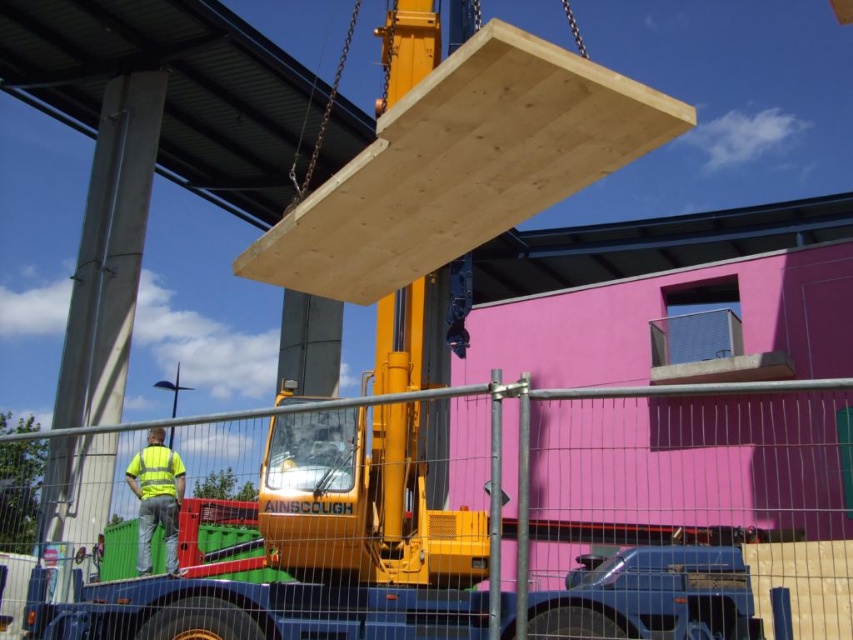
Between yellow reflective vest at lower left and yellow reflective safety vest at lower left, which one appears on the right side from the viewer's perspective?

Positioned to the right is yellow reflective safety vest at lower left.

Can you confirm if yellow reflective vest at lower left is shorter than yellow reflective safety vest at lower left?

In fact, yellow reflective vest at lower left may be taller than yellow reflective safety vest at lower left.

Does point (170, 548) lie behind point (132, 470)?

No, (170, 548) is closer to viewer.

The width and height of the screenshot is (853, 640). I want to click on yellow reflective vest at lower left, so click(x=155, y=497).